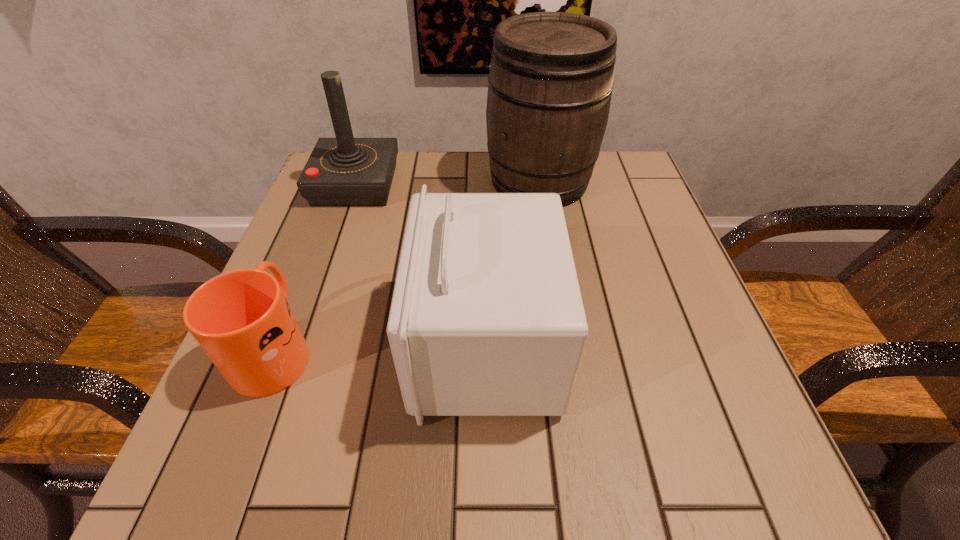
At what (x,y) coordinates should I click in order to perform the action: click on the tallest object. Please return your answer as a coordinate pair (x, y). Image resolution: width=960 pixels, height=540 pixels. Looking at the image, I should click on (550, 84).

At what (x,y) coordinates should I click in order to perform the action: click on joystick. Please return your answer as a coordinate pair (x, y). Looking at the image, I should click on (344, 171).

I want to click on the first-aid kit, so pos(487,319).

Where is `the shortest object`? The image size is (960, 540). the shortest object is located at coordinates (241, 319).

I want to click on vacant region located on the right of the tallest object, so click(x=618, y=181).

Where is `free spot located on the rectangular base of the joystick`? This screenshot has height=540, width=960. free spot located on the rectangular base of the joystick is located at coordinates (434, 184).

In order to click on free space located 0.050m on the front-facing side of the first-aid kit in this screenshot , I will do `click(385, 345)`.

Identify the location of vacant region located on the front-facing side of the first-aid kit. This screenshot has width=960, height=540. (367, 345).

The width and height of the screenshot is (960, 540). Find the location of `free point located 0.270m on the front-facing side of the first-aid kit`. free point located 0.270m on the front-facing side of the first-aid kit is located at coordinates (251, 345).

Locate an element on the screen. This screenshot has width=960, height=540. vacant space located on the handle side of the mug is located at coordinates (315, 246).